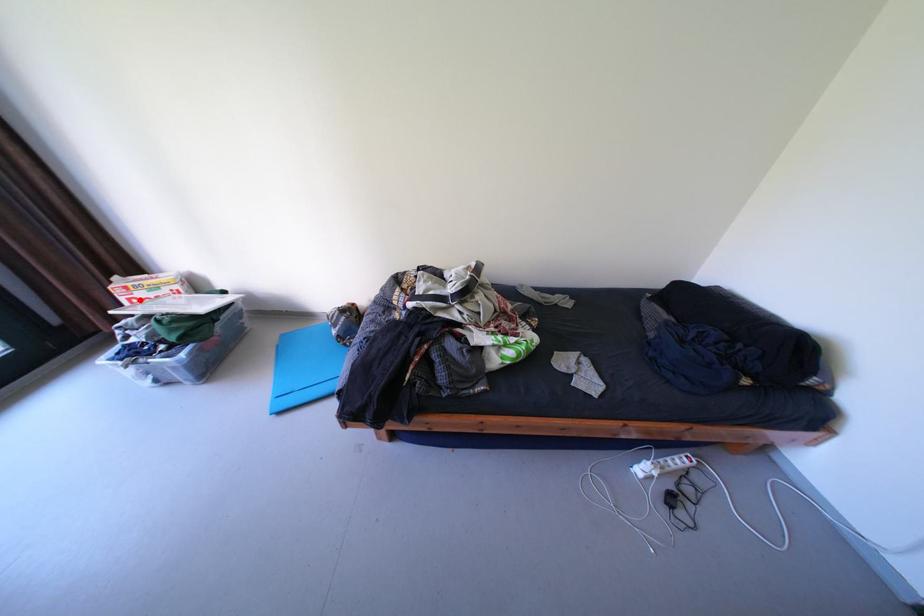
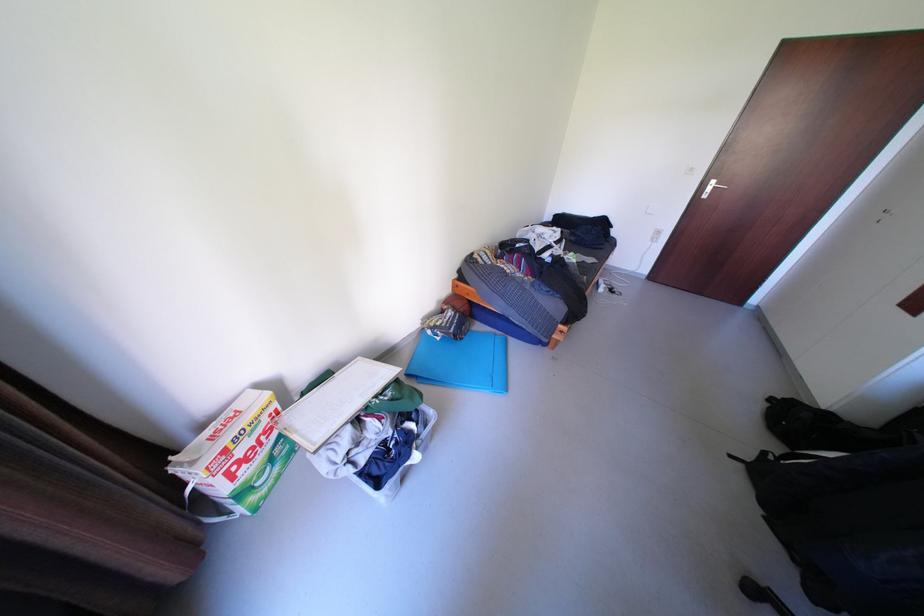
Question: I am providing you with two images of the same scene from different viewpoints. A red point is shown in image1. For the corresponding object point in image2, is it positioned nearer or farther from the camera?

Choices:
 (A) Nearer
 (B) Farther

Answer: (A)